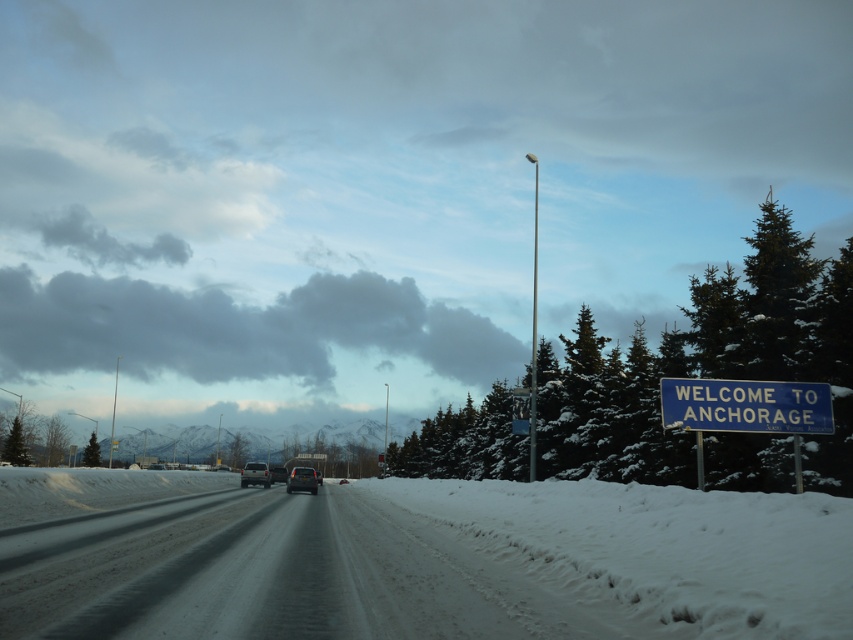
Question: Can you confirm if snowy asphalt highway at center is smaller than metallic silver sedan at center?

Choices:
 (A) no
 (B) yes

Answer: (A)

Question: Which object is farther from the camera taking this photo?

Choices:
 (A) snowy asphalt highway at center
 (B) white fluffy snow at right

Answer: (A)

Question: Can you confirm if metallic silver sedan at center is bigger than matte black suv at center?

Choices:
 (A) yes
 (B) no

Answer: (A)

Question: Which object is positioned farthest from the snowy asphalt highway at center?

Choices:
 (A) white fluffy snow at right
 (B) snow-covered evergreen at right

Answer: (B)

Question: Does snowy asphalt highway at center have a larger size compared to snow-covered evergreen at right?

Choices:
 (A) yes
 (B) no

Answer: (B)

Question: Based on their relative distances, which object is farther from the white fluffy snow at right?

Choices:
 (A) blue metallic signboard at right
 (B) matte black suv at center
 (C) snow-covered evergreen at right

Answer: (C)